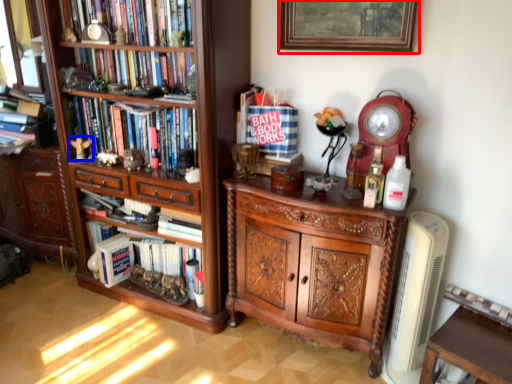
Question: Among these objects, which one is nearest to the camera, picture frame (highlighted by a red box) or toy (highlighted by a blue box)?

Choices:
 (A) picture frame
 (B) toy

Answer: (A)